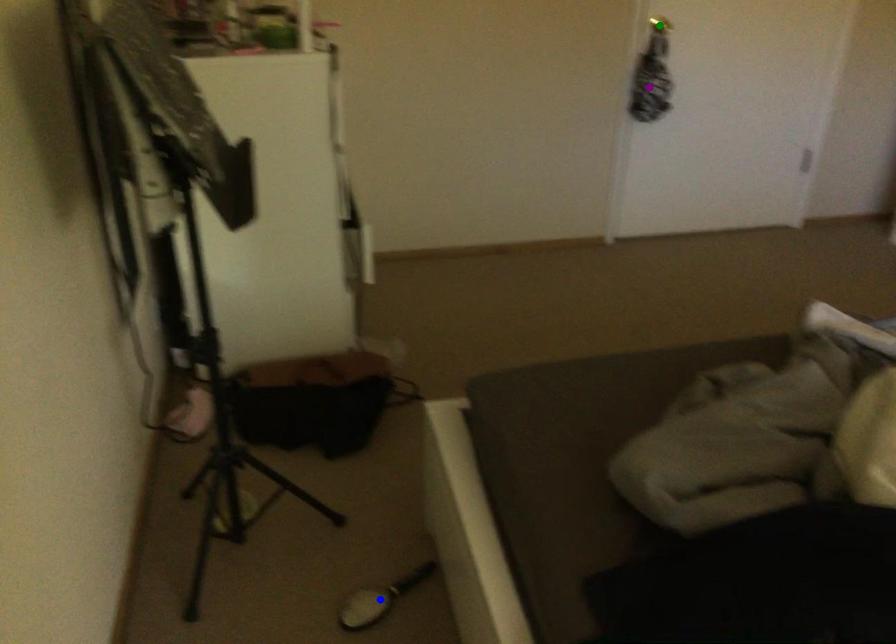
Order these from nearest to farthest:
1. purple point
2. blue point
3. green point

blue point → green point → purple point